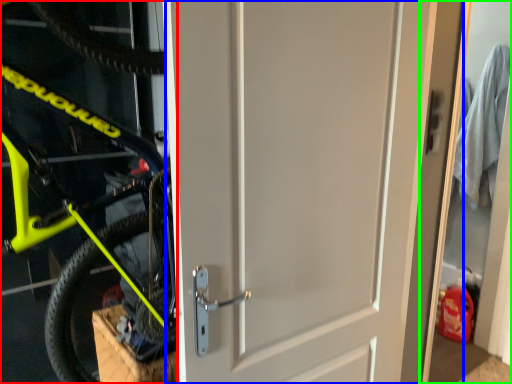
Question: Which is nearer to the bicycle (highlighted by a red box)? door (highlighted by a blue box) or garage door (highlighted by a green box).

Choices:
 (A) door
 (B) garage door

Answer: (A)